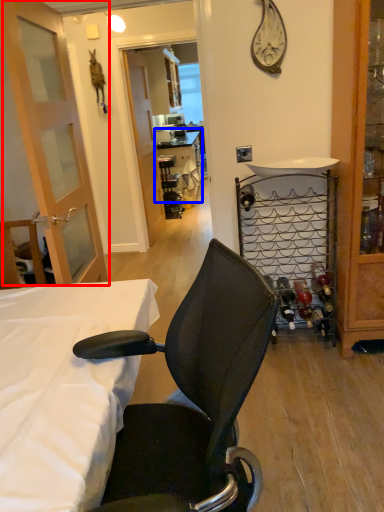
Question: Which object appears closest to the camera in this image, door (highlighted by a red box) or table (highlighted by a blue box)?

Choices:
 (A) door
 (B) table

Answer: (A)